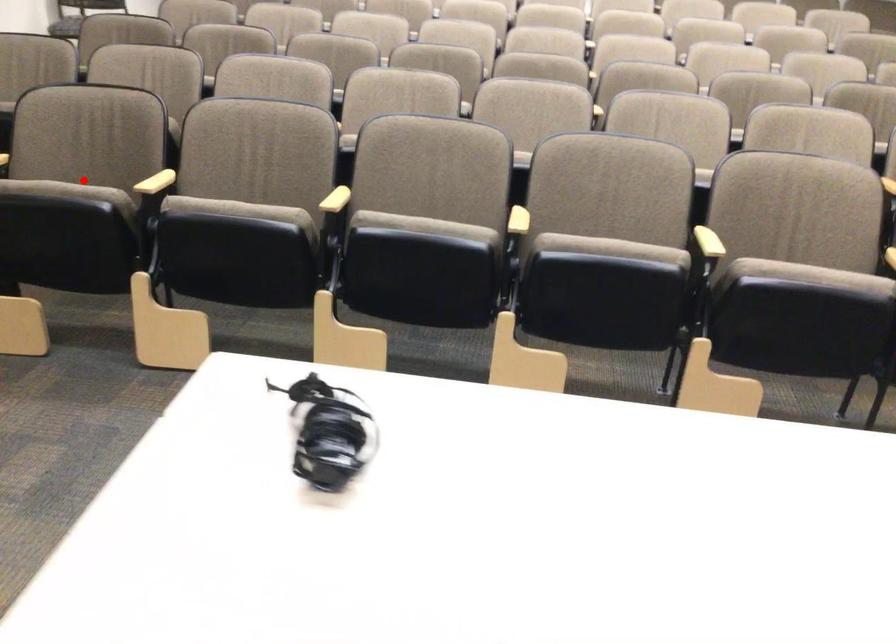
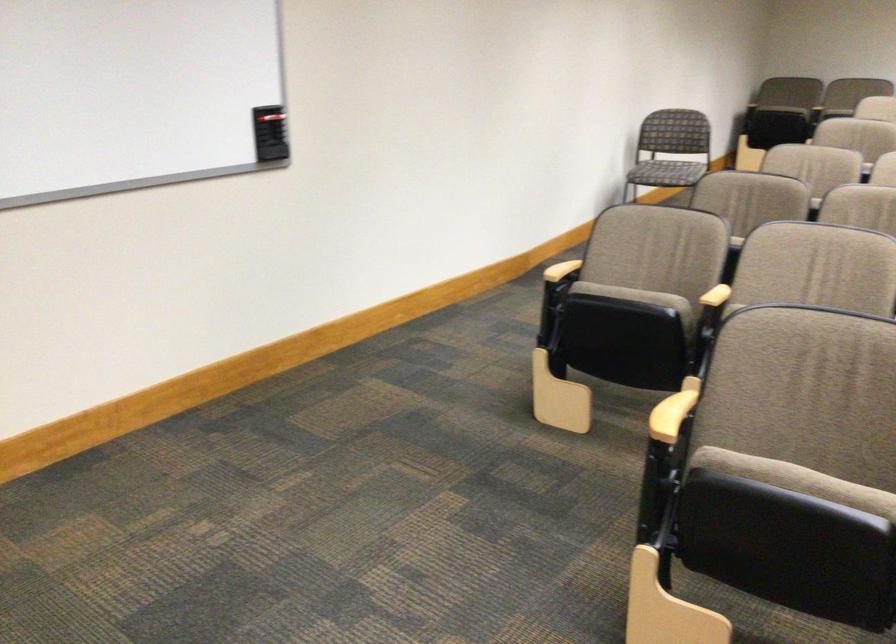
Question: I am providing you with two images of the same scene from different viewpoints. Image1 has a red point marked. In image2, the corresponding 3D location appears at what relative position? Reply with the corresponding letter.

Choices:
 (A) Closer
 (B) Farther

Answer: (A)